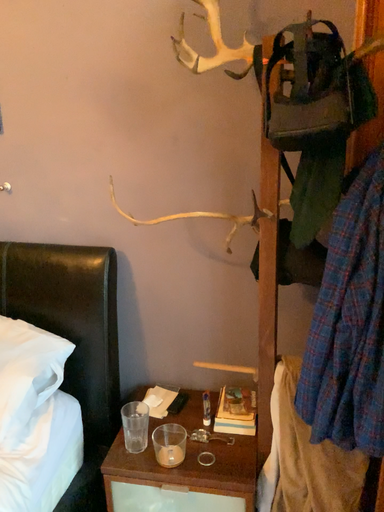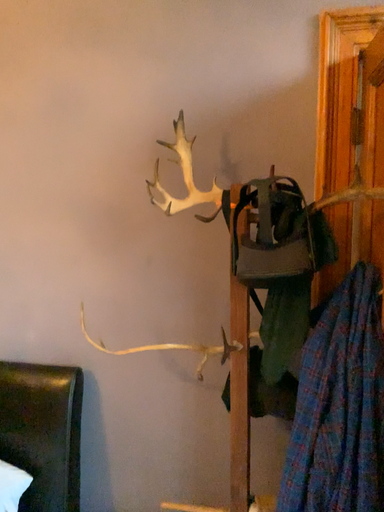
Question: Which way did the camera rotate in the video?

Choices:
 (A) rotated downward
 (B) rotated upward

Answer: (B)